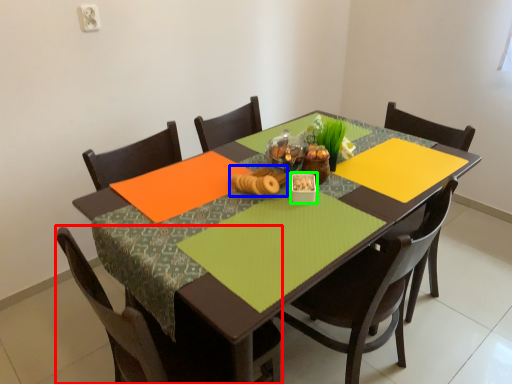
Question: Considering the real-world distances, which object is farthest from chair (highlighted by a red box)? food (highlighted by a blue box) or tableware (highlighted by a green box)?

Choices:
 (A) food
 (B) tableware

Answer: (B)